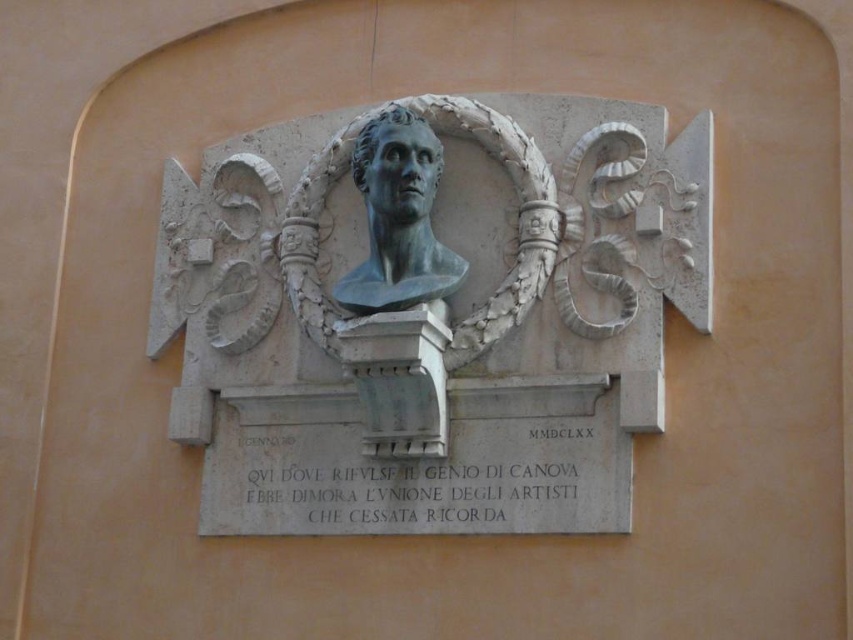
Does white stone plaque at center have a smaller size compared to blue-green stone bust at center?

No.

Is point (494, 452) closer to viewer compared to point (428, 280)?

Yes, it is.

Which is behind, point (225, 452) or point (444, 260)?

The point (225, 452) is more distant.

Image resolution: width=853 pixels, height=640 pixels. Find the location of `white stone plaque at center`. white stone plaque at center is located at coordinates (421, 464).

Is black stone plaque at center thinner than blue-green stone bust at center?

In fact, black stone plaque at center might be wider than blue-green stone bust at center.

Which is in front, point (445, 468) or point (390, 208)?

Point (445, 468) is in front.

Where is `black stone plaque at center`? Image resolution: width=853 pixels, height=640 pixels. black stone plaque at center is located at coordinates (412, 496).

Can you confirm if black stone plaque at center is positioned above bronze bust at center?

Actually, black stone plaque at center is below bronze bust at center.

Is black stone plaque at center to the right of bronze bust at center from the viewer's perspective?

Indeed, black stone plaque at center is positioned on the right side of bronze bust at center.

Image resolution: width=853 pixels, height=640 pixels. Describe the element at coordinates (412, 496) in the screenshot. I see `black stone plaque at center` at that location.

Find the location of a particular element. The height and width of the screenshot is (640, 853). black stone plaque at center is located at coordinates (412, 496).